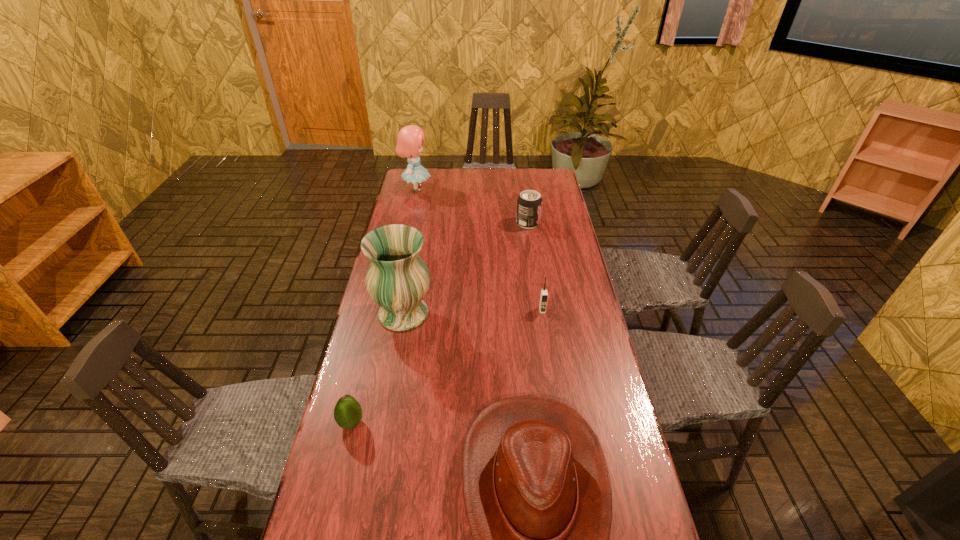
The height and width of the screenshot is (540, 960). Find the location of `free location at the far left corner of the desktop`. free location at the far left corner of the desktop is located at coordinates (438, 171).

This screenshot has height=540, width=960. In the image, there is a desktop. What are the coordinates of `free region at the far right corner` in the screenshot? It's located at (552, 170).

Find the location of a particular element. The width and height of the screenshot is (960, 540). free space that is in between the soda can and the cellular telephone is located at coordinates (535, 267).

At what (x,y) coordinates should I click in order to perform the action: click on free area in between the avocado and the soda can. Please return your answer as a coordinate pair (x, y). Looking at the image, I should click on (440, 323).

The height and width of the screenshot is (540, 960). Identify the location of object that is the second closest one to the farthest object. (397, 279).

Identify the location of the second closest object to the cowboy hat. This screenshot has height=540, width=960. (347, 413).

At what (x,y) coordinates should I click in order to perform the action: click on free region that satisfies the following two spatial constraints: 1. on the front-facing side of the farthest object; 2. on the back side of the soda can. Please return your answer as a coordinate pair (x, y). The image size is (960, 540). Looking at the image, I should click on (409, 223).